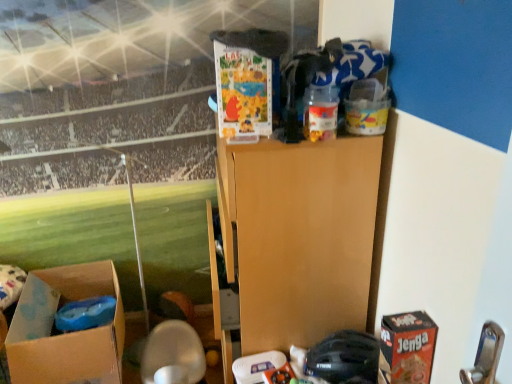
Question: Does point (266, 135) appear closer or farther from the camera than point (324, 129)?

Choices:
 (A) closer
 (B) farther

Answer: (B)

Question: Considering the positions of matte cardboard box at upper center, arranged as the 1th box when viewed from the front, and translucent plastic container at upper center, arranged as the 2th toy when viewed from the back, in the image, is matte cardboard box at upper center, arranged as the 1th box when viewed from the front, taller or shorter than translucent plastic container at upper center, arranged as the 2th toy when viewed from the back,?

Choices:
 (A) short
 (B) tall

Answer: (B)

Question: Which of these objects is positioned farthest from the red cardboard jenga box at lower right?

Choices:
 (A) matte cardboard box at upper center, positioned as the second box in left-to-right order
 (B) black matte helmet at lower center, the 2th toy viewed from the top
 (C) translucent plastic container at upper center, arranged as the 2th toy when viewed from the back
 (D) brown cardboard box at lower left, which appears as the first box when viewed from the back

Answer: (D)

Question: Which of these objects is positioned closest to the brown cardboard box at lower left, which is the second box from right to left?

Choices:
 (A) translucent plastic container at upper center, arranged as the first toy when viewed from the top
 (B) red cardboard jenga box at lower right
 (C) black matte helmet at lower center, the 2th toy viewed from the top
 (D) matte cardboard box at upper center, acting as the first box starting from the right

Answer: (C)